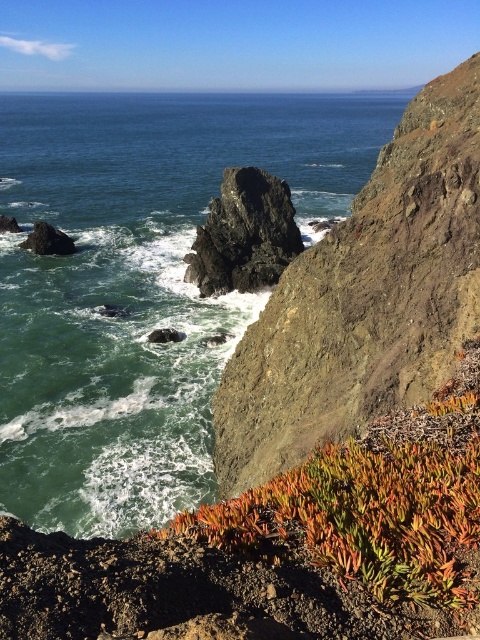
Who is more distant from viewer, (x=428, y=134) or (x=231, y=227)?

The point (x=231, y=227) is behind.

Is rough gray cliff at center below rough rock at center?

No, rough gray cliff at center is not below rough rock at center.

Who is more distant from viewer, (x=262, y=333) or (x=262, y=227)?

Point (x=262, y=227)

Image resolution: width=480 pixels, height=640 pixels. What are the coordinates of `rough gray cliff at center` in the screenshot? It's located at (364, 298).

Measure the distance from rough rock at center to dark gray rock at left.

11.86 meters

Who is lower down, rough rock at center or dark gray rock at left?

Positioned lower is rough rock at center.

The height and width of the screenshot is (640, 480). In order to click on rough rock at center in this screenshot , I will do `click(243, 234)`.

Where is `rough rock at center`? rough rock at center is located at coordinates (243, 234).

Which is above, green succulent at lower right or rough rock at center?

rough rock at center is higher up.

Does green succulent at lower right have a greater width compared to rough rock at center?

No, green succulent at lower right is not wider than rough rock at center.

Locate an element on the screen. This screenshot has height=640, width=480. green succulent at lower right is located at coordinates (370, 509).